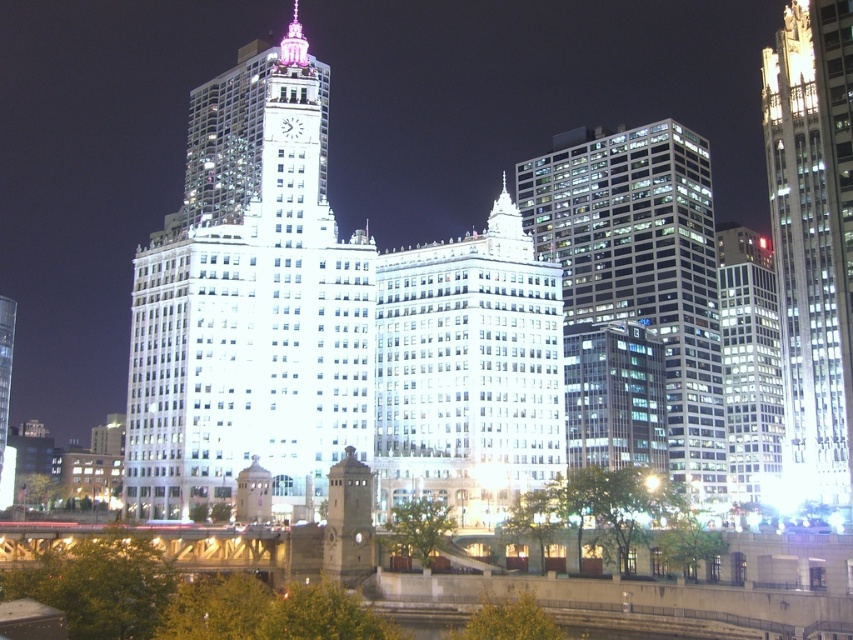
Question: Does glassy reflective skyscraper at center-right appear on the left side of matte glass skyscraper at right?

Choices:
 (A) no
 (B) yes

Answer: (B)

Question: Which point is closer to the camera?

Choices:
 (A) (828, 289)
 (B) (294, 506)
 (C) (764, 340)
 (D) (694, 262)

Answer: (B)

Question: Estimate the real-world distances between objects in this image. Which object is farther from the glassy reflective skyscraper at center-right?

Choices:
 (A) white glass building at center
 (B) shiny glass skyscraper at right

Answer: (A)

Question: Can you confirm if white glass building at center is thinner than shiny glass skyscraper at right?

Choices:
 (A) yes
 (B) no

Answer: (B)

Question: Does shiny glass skyscraper at right have a smaller size compared to matte glass skyscraper at right?

Choices:
 (A) yes
 (B) no

Answer: (B)

Question: Which point appears closest to the camera in this image?

Choices:
 (A) (659, 145)
 (B) (817, 248)
 (C) (758, 253)
 (D) (248, 225)

Answer: (D)